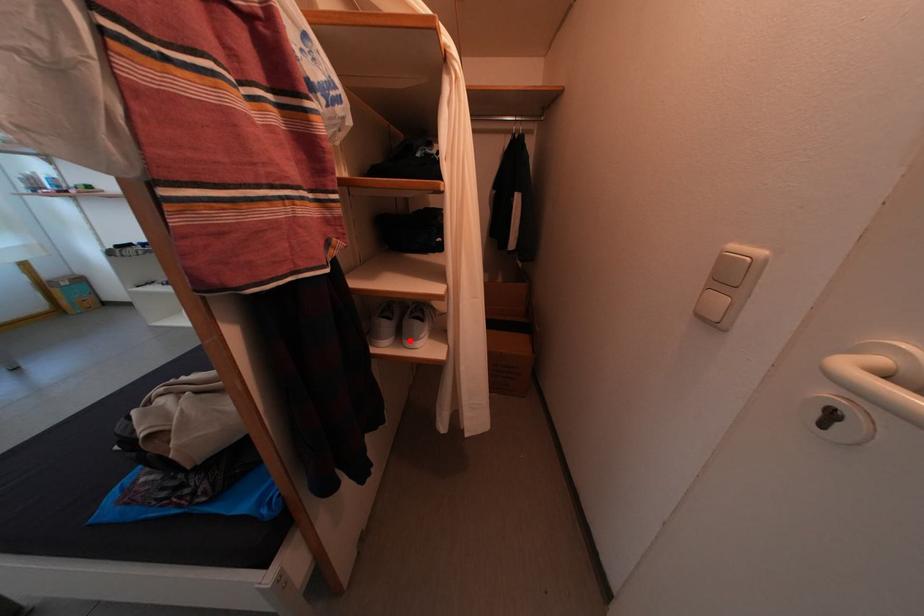
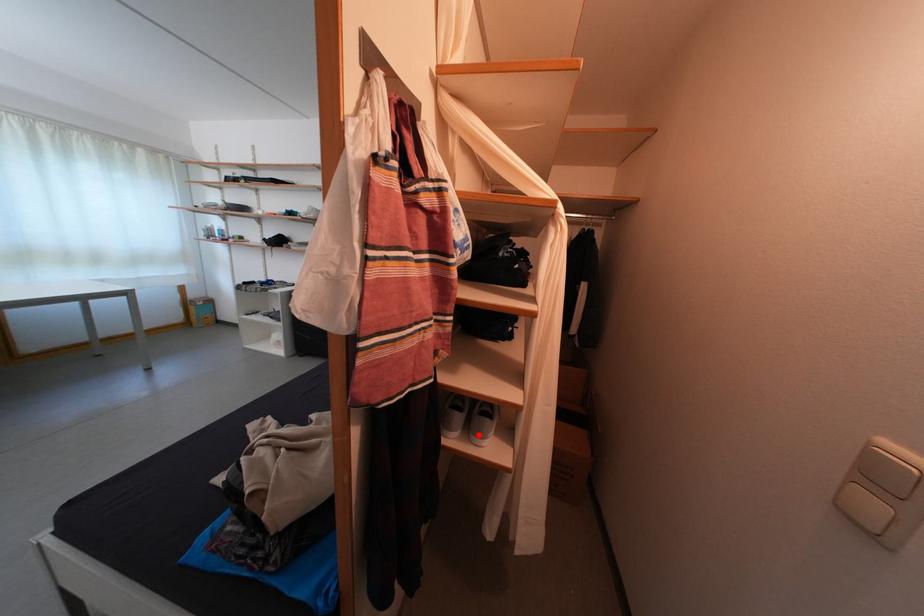
I am providing you with two images of the same scene from different viewpoints. A red point is marked on the first image and another point is marked on the second image. Does the point marked in image1 correspond to the same location as the one in image2?

Yes